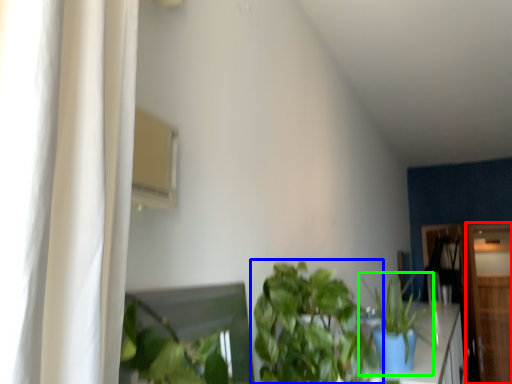
Question: Which object is the closest to the dresser (highlighted by a red box)? Choose among these: houseplant (highlighted by a blue box) or houseplant (highlighted by a green box).

Choices:
 (A) houseplant
 (B) houseplant

Answer: (B)